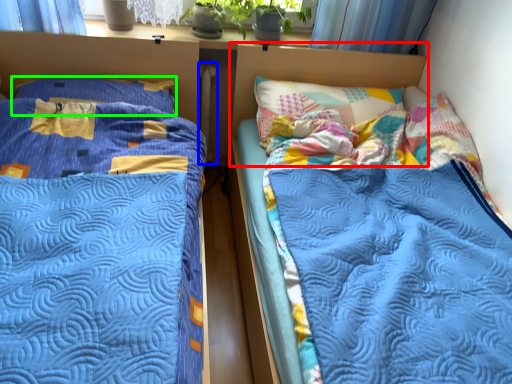
Question: Which object is positioned closest to headboard (highlighted by a red box)? Select from radiator (highlighted by a blue box) and pillow (highlighted by a green box).

Choices:
 (A) radiator
 (B) pillow

Answer: (A)